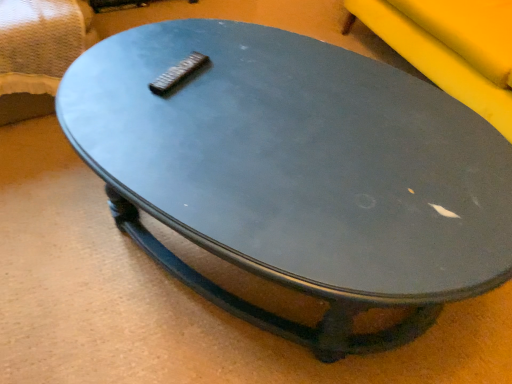
Where is `unoccupied region to the right of black plastic remote at center`? unoccupied region to the right of black plastic remote at center is located at coordinates (240, 80).